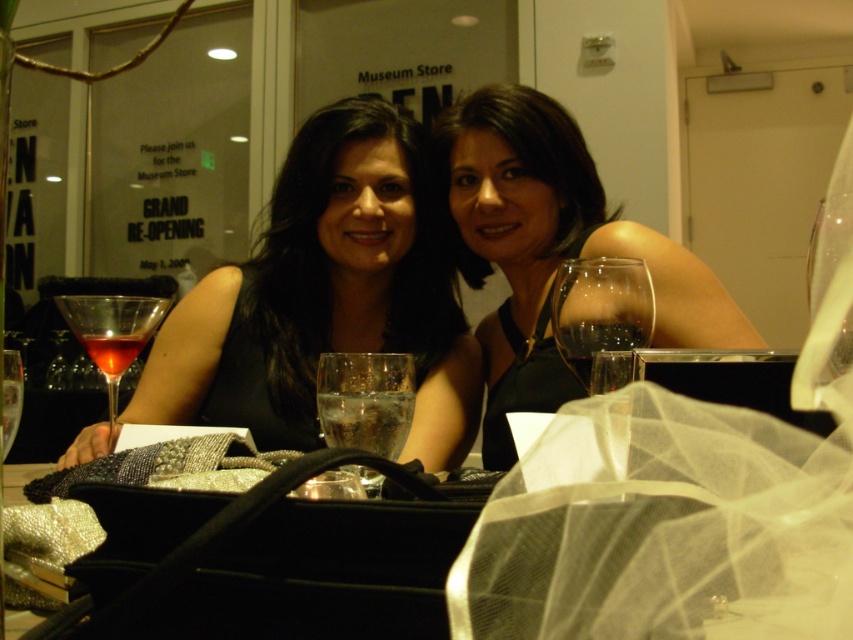
Looking at this image, you are a photographer at the event and want to capture a photo of the black satin dress at center and the clear glass wine glass at left. Based on their positions, which object is closer to the camera?

The black satin dress at center is located above the clear glass wine glass at left, meaning it is closer to the camera.

You are a guest at the event and want to grab a drink. The clear glass water at center is located at coordinates 0.627, 0.429. Which direction should you move to reach it from your current position at the edge of the table?

The clear glass water at center is located at coordinates (364, 401), so you should move towards the center of the table to reach it.